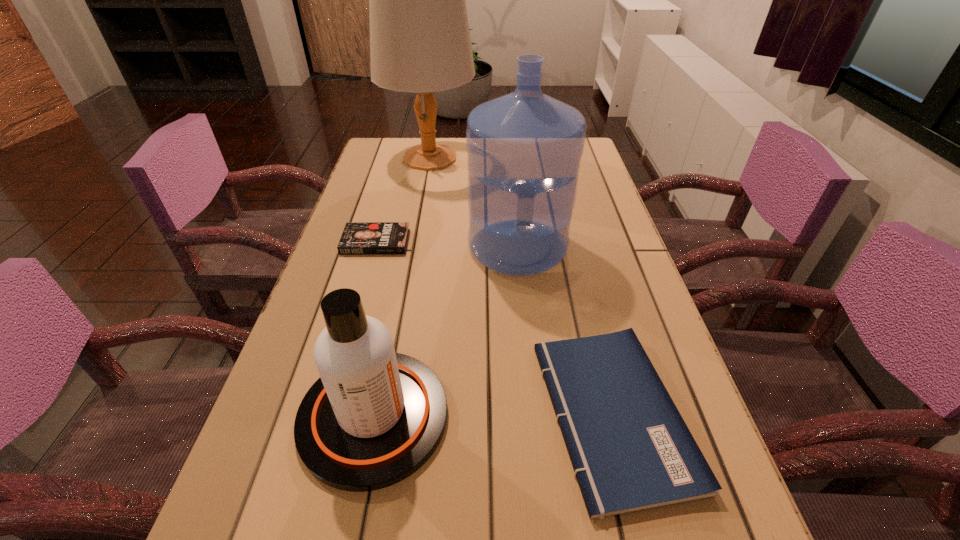
The image size is (960, 540). What are the coordinates of `object at the far edge` in the screenshot? It's located at (420, 42).

The image size is (960, 540). Find the location of `table lamp present at the left edge`. table lamp present at the left edge is located at coordinates (420, 42).

Find the location of `cleansing agent at the left edge`. cleansing agent at the left edge is located at coordinates [x=374, y=417].

At what (x,y) coordinates should I click in order to perform the action: click on book that is at the left edge. Please return your answer as a coordinate pair (x, y). Looking at the image, I should click on (358, 238).

Locate an element on the screen. The image size is (960, 540). water jug that is at the right edge is located at coordinates (524, 149).

You are a GUI agent. You are given a task and a screenshot of the screen. Output one action in this format:
    pyautogui.click(x=<x>, y=<y>)
    Task: Click on the paperback book situated at the right edge
    The image size is (960, 540).
    Given the screenshot: What is the action you would take?
    pyautogui.click(x=630, y=448)

Identify the location of object that is at the far left corner. The image size is (960, 540). (420, 42).

Image resolution: width=960 pixels, height=540 pixels. In the image, there is a desktop. Find the location of `vacant space at the left edge`. vacant space at the left edge is located at coordinates tap(352, 260).

In the image, there is a desktop. Find the location of `vacant space at the right edge`. vacant space at the right edge is located at coordinates (626, 325).

In the image, there is a desktop. What are the coordinates of `free region at the far left corner` in the screenshot? It's located at (396, 147).